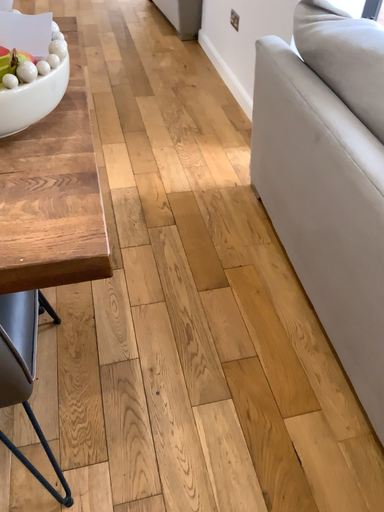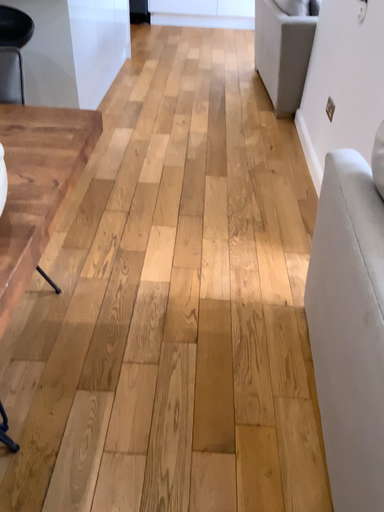
Question: How did the camera likely rotate when shooting the video?

Choices:
 (A) rotated left
 (B) rotated right

Answer: (A)